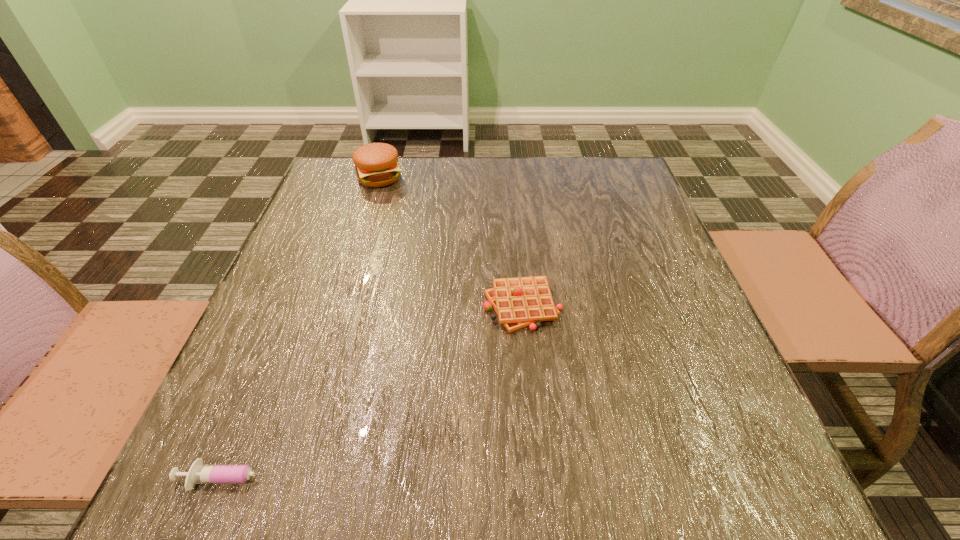
Where is `hamburger`? The image size is (960, 540). hamburger is located at coordinates (376, 164).

The width and height of the screenshot is (960, 540). Identify the location of the tallest object. (376, 164).

Where is `the rightmost object`? The height and width of the screenshot is (540, 960). the rightmost object is located at coordinates (519, 302).

Find the location of a particular element. The image size is (960, 540). the second tallest object is located at coordinates (519, 302).

Locate an element on the screen. The height and width of the screenshot is (540, 960). the shortest object is located at coordinates (198, 473).

Where is `syringe`? The height and width of the screenshot is (540, 960). syringe is located at coordinates (198, 473).

Where is `free location located on the right of the hamburger`? The height and width of the screenshot is (540, 960). free location located on the right of the hamburger is located at coordinates (545, 178).

You are a GUI agent. You are given a task and a screenshot of the screen. Output one action in this format:
    pyautogui.click(x=<x>, y=<y>)
    Task: Click on the free location located on the front of the waffle
    The height and width of the screenshot is (540, 960).
    Given the screenshot: What is the action you would take?
    pyautogui.click(x=537, y=455)

Find the location of a particular element. The height and width of the screenshot is (540, 960). vacant space located 0.160m on the right of the nearest object is located at coordinates (410, 478).

I want to click on object that is at the far edge, so click(x=376, y=164).